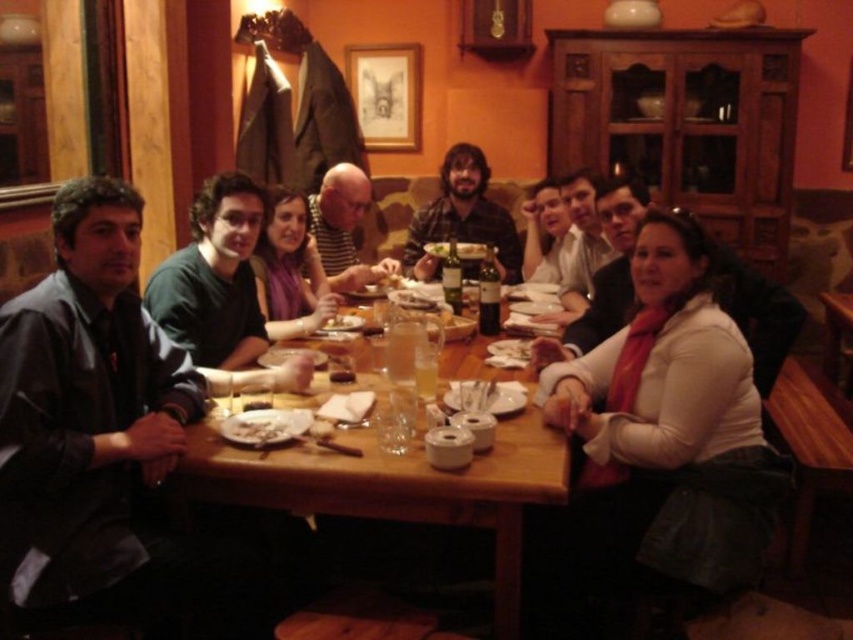
You are standing in the middle of the room and want to reach the wooden table at center. Which direction should you move in to get there?

Since the wooden table at center is located at point 0.766 on the x and 0.474 on the y axis, you should move towards the center of the room to reach it.

From the picture: You are a server at the restaurant and need to place a new dish on the table. The dish requires a space wider than the smooth wooden plate at center. Can the white matte scarf at right provide enough space for this dish?

The white matte scarf at right is wider than the smooth wooden plate at center, so it can provide enough space for the dish that requires a width greater than the smooth wooden plate at center.

You are a photographer trying to capture a group photo of the flannel shirt at center and the matte black shirt at center. If you want to ensure both shirts are fully visible in the frame, which shirt requires more space horizontally?

The flannel shirt at center requires more horizontal space because its width surpasses that of the matte black shirt at center.